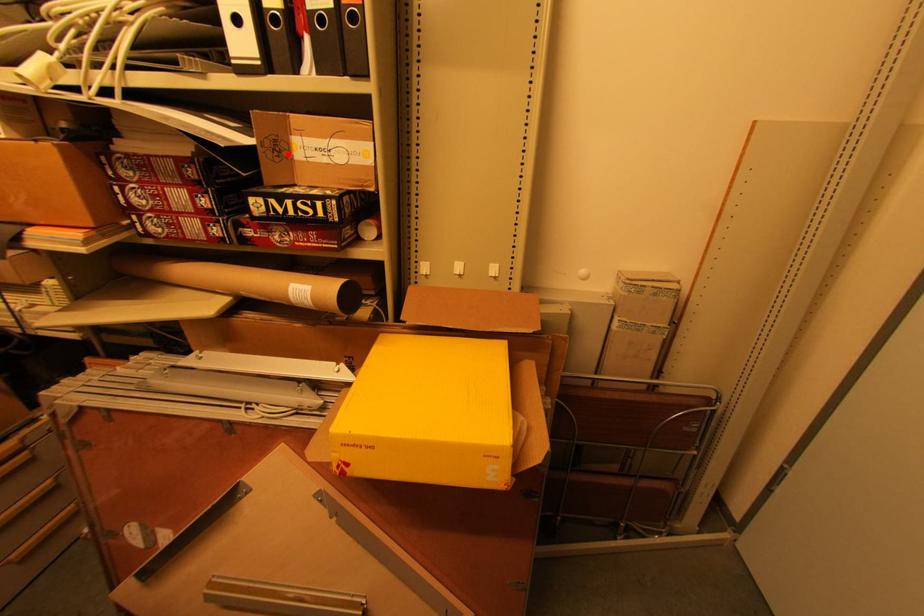
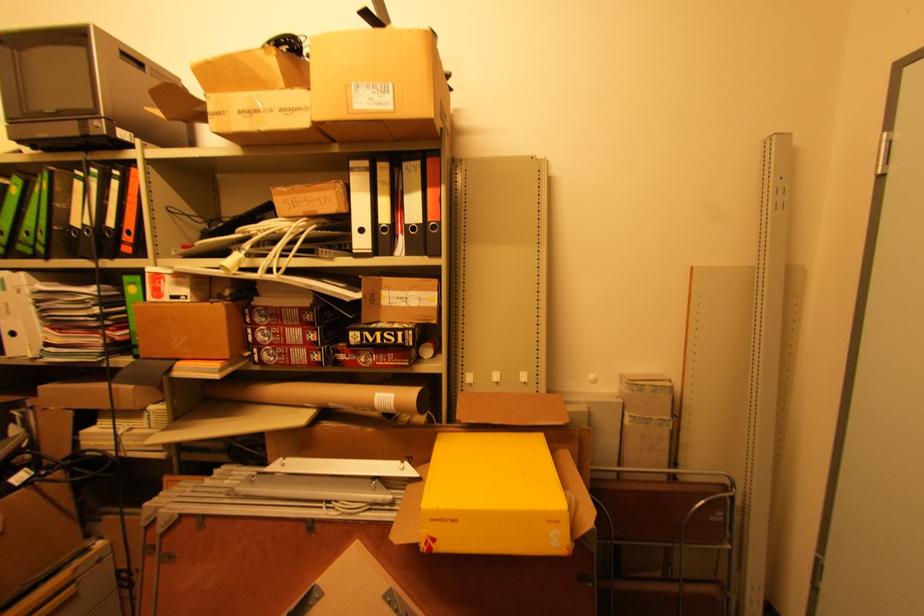
Locate, in the second image, the point that corresponds to the highlighted location in the first image.

(380, 302)